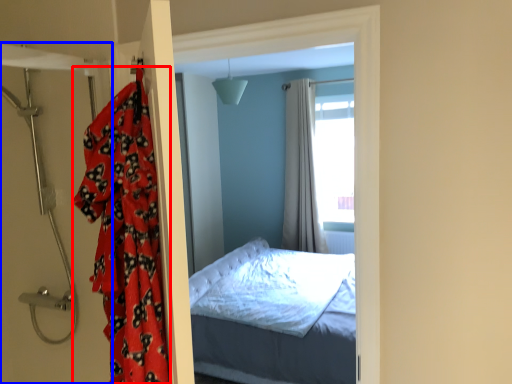
Question: Which object appears farthest to the camera in this image, blanket (highlighted by a red box) or door (highlighted by a blue box)?

Choices:
 (A) blanket
 (B) door

Answer: (B)